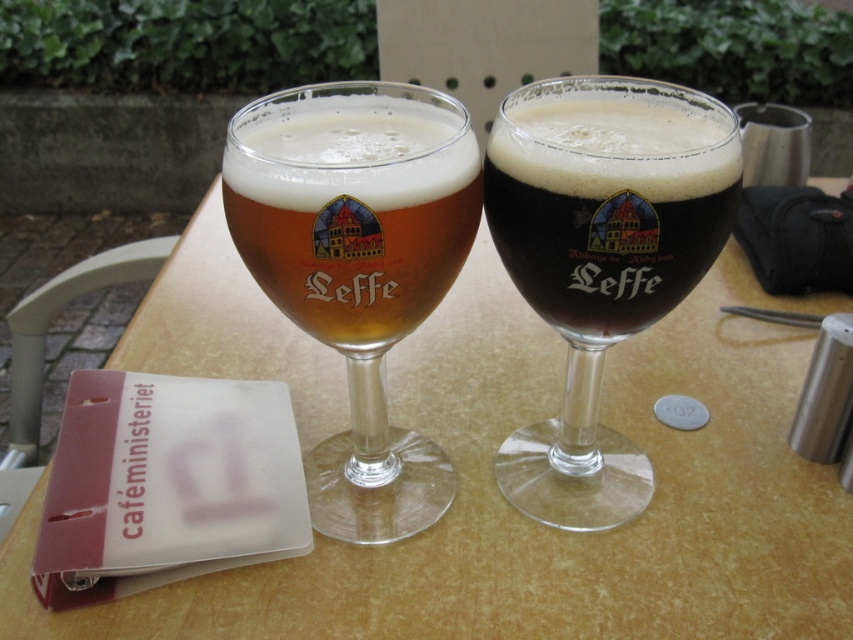
Question: In this image, where is dark brown glass at center located relative to translucent glass beer glass at center?

Choices:
 (A) right
 (B) left

Answer: (A)

Question: Can you confirm if dark brown glass at center is smaller than translucent glass beer glass at center?

Choices:
 (A) yes
 (B) no

Answer: (B)

Question: Which object is closer to the camera taking this photo?

Choices:
 (A) translucent glass beer glass at center
 (B) dark brown glass at center

Answer: (A)

Question: Estimate the real-world distances between objects in this image. Which object is closer to the dark brown glass at center?

Choices:
 (A) translucent glass beer glass at center
 (B) wooden table at center

Answer: (A)

Question: Is wooden table at center to the right of dark brown glass at center from the viewer's perspective?

Choices:
 (A) no
 (B) yes

Answer: (A)

Question: Which of the following is the closest to the observer?

Choices:
 (A) translucent glass beer glass at center
 (B) dark brown glass at center

Answer: (A)